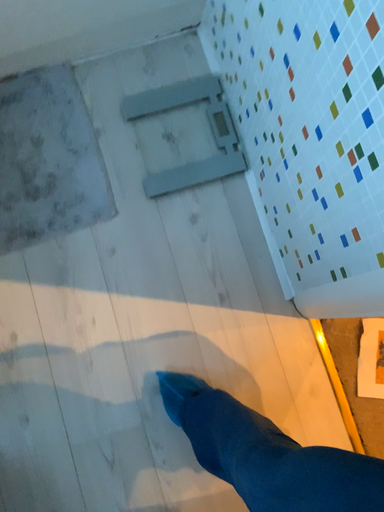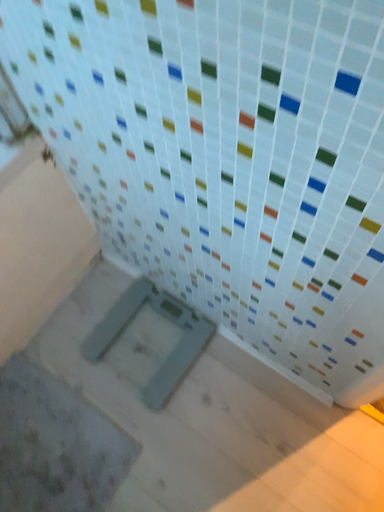
Question: Which way did the camera rotate in the video?

Choices:
 (A) rotated upward
 (B) rotated downward

Answer: (A)